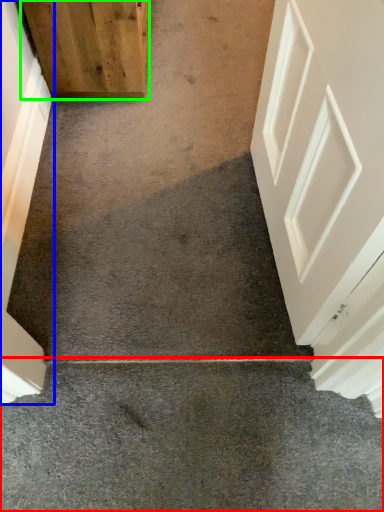
Question: Which object is positioned farthest from concrete (highlighted by a red box)? Select from door (highlighted by a blue box) and door (highlighted by a green box).

Choices:
 (A) door
 (B) door

Answer: (B)